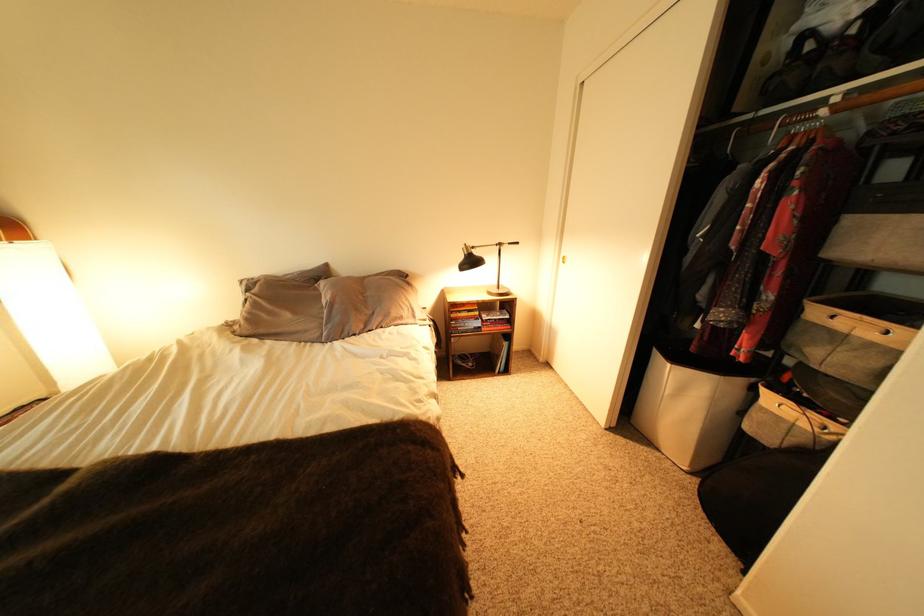
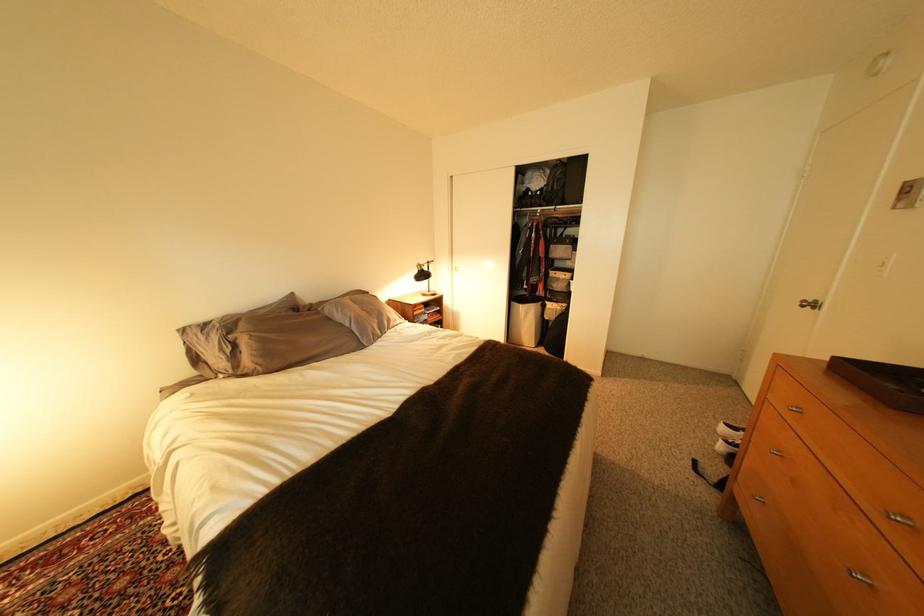
The point at (780, 411) is marked in the first image. Where is the corresponding point in the second image?

(563, 310)